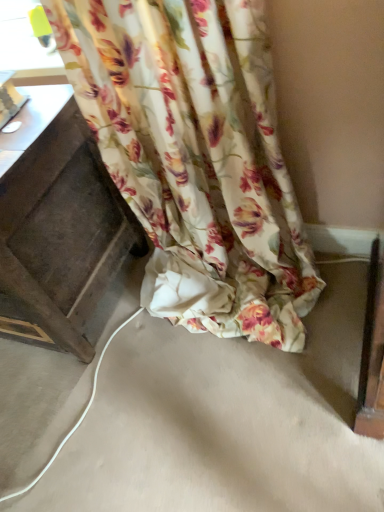
Question: Is dark wood drawer at left to the right of transparent plastic window at upper left from the viewer's perspective?

Choices:
 (A) yes
 (B) no

Answer: (B)

Question: Does dark wood drawer at left touch transparent plastic window at upper left?

Choices:
 (A) no
 (B) yes

Answer: (A)

Question: From the image's perspective, is dark wood drawer at left located above transparent plastic window at upper left?

Choices:
 (A) no
 (B) yes

Answer: (A)

Question: Does dark wood drawer at left turn towards transparent plastic window at upper left?

Choices:
 (A) no
 (B) yes

Answer: (A)

Question: Does dark wood drawer at left have a lesser width compared to transparent plastic window at upper left?

Choices:
 (A) yes
 (B) no

Answer: (B)

Question: Considering their positions, is dark wood drawer at left located in front of or behind floral fabric curtain at lower center?

Choices:
 (A) front
 (B) behind

Answer: (B)

Question: Considering the relative positions of dark wood drawer at left and floral fabric curtain at lower center in the image provided, is dark wood drawer at left to the left or to the right of floral fabric curtain at lower center?

Choices:
 (A) right
 (B) left

Answer: (B)

Question: Is point (119, 201) positioned closer to the camera than point (263, 72)?

Choices:
 (A) closer
 (B) farther

Answer: (B)

Question: Choose the correct answer: Is dark wood drawer at left inside floral fabric curtain at lower center or outside it?

Choices:
 (A) outside
 (B) inside

Answer: (A)

Question: Relative to floral fabric curtain at lower center, is transparent plastic window at upper left in front or behind?

Choices:
 (A) behind
 (B) front

Answer: (A)

Question: Is transparent plastic window at upper left taller or shorter than floral fabric curtain at lower center?

Choices:
 (A) short
 (B) tall

Answer: (A)

Question: Is transparent plastic window at upper left to the left or to the right of floral fabric curtain at lower center in the image?

Choices:
 (A) left
 (B) right

Answer: (A)

Question: From a real-world perspective, is transparent plastic window at upper left positioned above or below floral fabric curtain at lower center?

Choices:
 (A) below
 (B) above

Answer: (B)

Question: Considering the positions of floral fabric curtain at lower center and transparent plastic window at upper left in the image, is floral fabric curtain at lower center bigger or smaller than transparent plastic window at upper left?

Choices:
 (A) big
 (B) small

Answer: (A)

Question: Is floral fabric curtain at lower center wider or thinner than transparent plastic window at upper left?

Choices:
 (A) wide
 (B) thin

Answer: (A)